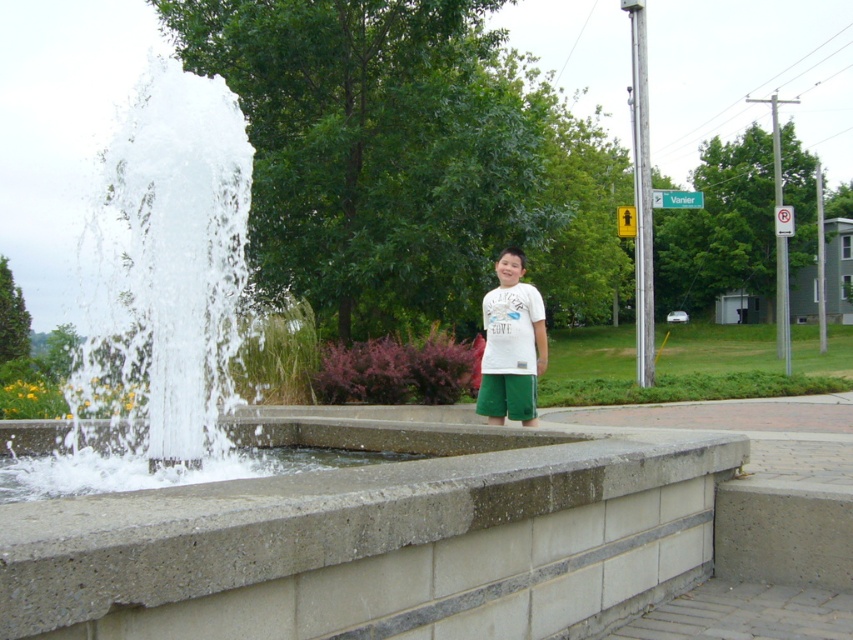
You are standing in the park and see the concrete ledge at center and the white cotton shirt at center. Which object is positioned to the left?

The concrete ledge at center is positioned to the left of the white cotton shirt at center.

Consider the image. You are standing at point (376, 538) in the park scene. What object is located exactly at this coordinate?

The concrete ledge at center is located exactly at point (376, 538).

You are a photographer trying to capture a wide shot of the scene. The camera you are using has a maximum frame width of 1 meter. Given that the concrete ledge at center and the white cotton shirt at center are both in the frame, can you fit both objects within the camera frame?

The concrete ledge at center is wider than the white cotton shirt at center. Since the camera frame can only accommodate up to 1 meter in width, and the concrete ledge at center is wider than the shirt, it depends on their combined widths. However, the description only states the ledge is wider than the shirt but does not provide exact measurements. Without knowing the exact width of the ledge, we cannot definitively determine if both will fit within the 1 meter limit.